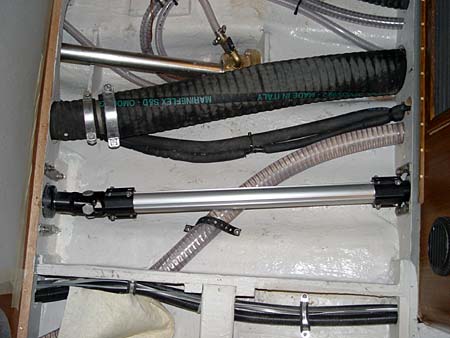
Where is `screws`? This screenshot has width=450, height=338. screws is located at coordinates (304, 296), (302, 330).